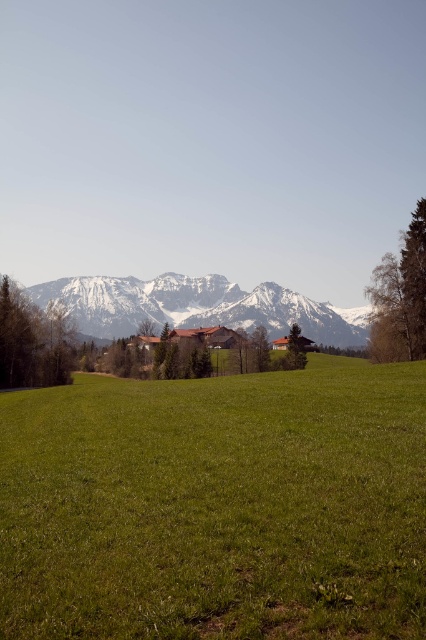
Can you confirm if green grassy pasture at center is smaller than snowy rock mountain range at center?

Yes.

Is green grassy pasture at center shorter than snowy rock mountain range at center?

Yes.

Is point (161, 564) less distant than point (118, 330)?

Yes, it is.

Find the location of a particular element. green grassy pasture at center is located at coordinates (216, 506).